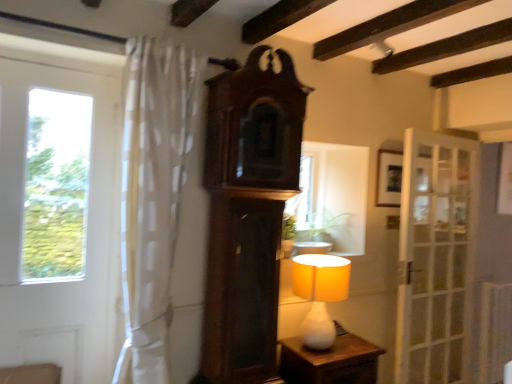
Question: Is white glass door at left, placed as the 1th door when sorted from left to right, to the left or to the right of white matte table lamp at center in the image?

Choices:
 (A) left
 (B) right

Answer: (A)

Question: In terms of width, does white glass door at left, placed as the 1th door when sorted from left to right, look wider or thinner when compared to white matte table lamp at center?

Choices:
 (A) thin
 (B) wide

Answer: (A)

Question: Which object is positioned closest to the white glossy nightstand at lower center?

Choices:
 (A) green leafy plant at center
 (B) white glass door at left, arranged as the 2th door when viewed from the right
 (C) dark wood clock at center
 (D) white sheer curtain at left
 (E) white glass door at right, which is counted as the first door, starting from the right

Answer: (C)

Question: Which object is positioned closest to the wooden picture frame at upper right?

Choices:
 (A) white sheer curtain at left
 (B) white glass door at right, the first door viewed from the back
 (C) dark wood clock at center
 (D) white glass door at left, arranged as the 2th door when viewed from the right
 (E) white glossy nightstand at lower center

Answer: (B)